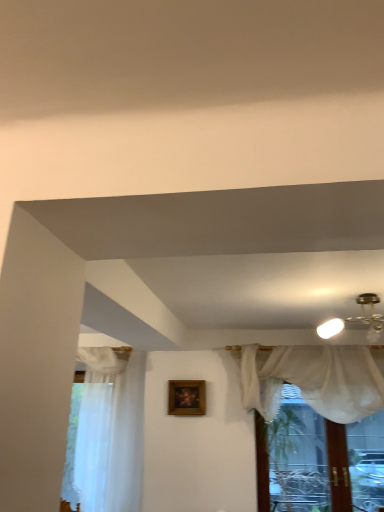
Question: Is wooden frame at center shorter than sheer white curtain at upper center?

Choices:
 (A) yes
 (B) no

Answer: (A)

Question: Can you confirm if wooden frame at center is smaller than sheer white curtain at upper center?

Choices:
 (A) no
 (B) yes

Answer: (B)

Question: Is wooden frame at center in front of sheer white curtain at upper center?

Choices:
 (A) yes
 (B) no

Answer: (B)

Question: Is wooden frame at center taller than sheer white curtain at upper center?

Choices:
 (A) yes
 (B) no

Answer: (B)

Question: From a real-world perspective, is wooden frame at center below sheer white curtain at upper center?

Choices:
 (A) yes
 (B) no

Answer: (B)

Question: Which is correct: sheer white curtain at upper center is inside sheer white curtain at left, or outside of it?

Choices:
 (A) inside
 (B) outside

Answer: (B)

Question: Is point (319, 510) positioned closer to the camera than point (107, 430)?

Choices:
 (A) closer
 (B) farther

Answer: (A)

Question: Visually, is sheer white curtain at upper center positioned to the left or to the right of sheer white curtain at left?

Choices:
 (A) left
 (B) right

Answer: (B)

Question: From their relative heights in the image, would you say sheer white curtain at upper center is taller or shorter than sheer white curtain at left?

Choices:
 (A) tall
 (B) short

Answer: (B)

Question: From a real-world perspective, is wooden frame at center positioned above or below sheer white curtain at upper center?

Choices:
 (A) below
 (B) above

Answer: (B)

Question: Based on their positions, is wooden frame at center located to the left or right of sheer white curtain at upper center?

Choices:
 (A) right
 (B) left

Answer: (B)

Question: Is point (173, 407) closer or farther from the camera than point (288, 438)?

Choices:
 (A) closer
 (B) farther

Answer: (B)

Question: Considering the positions of wooden frame at center and sheer white curtain at upper center in the image, is wooden frame at center wider or thinner than sheer white curtain at upper center?

Choices:
 (A) thin
 (B) wide

Answer: (A)

Question: From a real-world perspective, is sheer white curtain at upper center positioned above or below wooden frame at center?

Choices:
 (A) above
 (B) below

Answer: (B)

Question: Considering the relative positions of sheer white curtain at upper center and wooden frame at center in the image provided, is sheer white curtain at upper center to the left or to the right of wooden frame at center?

Choices:
 (A) left
 (B) right

Answer: (B)